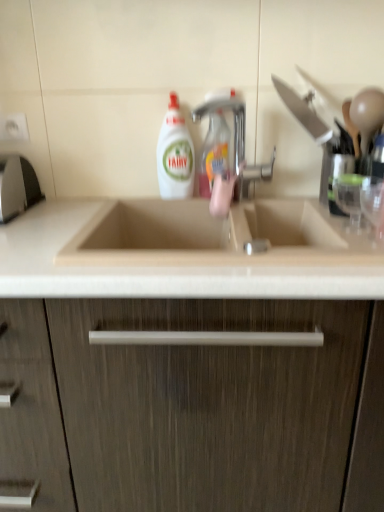
Image resolution: width=384 pixels, height=512 pixels. What do you see at coordinates (14, 127) in the screenshot? I see `white plastic electric outlet at upper left` at bounding box center [14, 127].

In order to face beige wood cabinet at center, should I rotate leftwards or rightwards?

Rotate your view left by about 1.898°.

The height and width of the screenshot is (512, 384). What do you see at coordinates (181, 253) in the screenshot? I see `beige marble countertop at center` at bounding box center [181, 253].

Find the location of `beige marble countertop at center`. beige marble countertop at center is located at coordinates (181, 253).

Describe the element at coordinates (213, 146) in the screenshot. I see `translucent plastic spray bottle at center, which is counted as the second cleaning product, starting from the left` at that location.

Where is `white plastic electric outlet at upper left`? Image resolution: width=384 pixels, height=512 pixels. white plastic electric outlet at upper left is located at coordinates (14, 127).

Is white plastic electric outlet at upper left a part of beige wood cabinet at center?

No.

Can you confirm if beige wood cabinet at center is positioned to the left of white plastic electric outlet at upper left?

In fact, beige wood cabinet at center is to the right of white plastic electric outlet at upper left.

Is beige wood cabinet at center touching white plastic electric outlet at upper left?

No, beige wood cabinet at center is not in contact with white plastic electric outlet at upper left.

Identify the location of electric outlet that appears on the left of white glossy liquid at center, the 1th cleaning product positioned from the left. (14, 127).

In the scene shown: From the image's perspective, between white plastic electric outlet at upper left and white glossy liquid at center, the second cleaning product in the right-to-left sequence, which one is located above?

From the image's view, white plastic electric outlet at upper left is above.

Can white glossy liquid at center, the second cleaning product in the right-to-left sequence, be found inside white plastic electric outlet at upper left?

No, white plastic electric outlet at upper left does not contain white glossy liquid at center, the second cleaning product in the right-to-left sequence.

Is white plastic electric outlet at upper left taller or shorter than white glossy liquid at center, the 1th cleaning product positioned from the left?

In the image, white plastic electric outlet at upper left appears to be shorter than white glossy liquid at center, the 1th cleaning product positioned from the left.

Does translucent plastic spray bottle at center, which is counted as the second cleaning product, starting from the left, come behind white plastic electric outlet at upper left?

No, it is not.

Based on the photo, is translucent plastic spray bottle at center, which is counted as the second cleaning product, starting from the left, oriented towards white plastic electric outlet at upper left?

No, translucent plastic spray bottle at center, which is counted as the second cleaning product, starting from the left, is not turned towards white plastic electric outlet at upper left.

Consider the image. Would you say translucent plastic spray bottle at center, which is counted as the second cleaning product, starting from the left, is to the left or to the right of white plastic electric outlet at upper left in the picture?

From the image, it's evident that translucent plastic spray bottle at center, which is counted as the second cleaning product, starting from the left, is to the right of white plastic electric outlet at upper left.

Considering the positions of point (152, 260) and point (17, 116), is point (152, 260) closer or farther from the camera than point (17, 116)?

Point (152, 260) is positioned closer to the camera compared to point (17, 116).

From their relative heights in the image, would you say beige marble countertop at center is taller or shorter than white plastic electric outlet at upper left?

Clearly, beige marble countertop at center is taller compared to white plastic electric outlet at upper left.

How many degrees apart are the facing directions of beige marble countertop at center and white plastic electric outlet at upper left?

0.567 degrees.

Is white plastic electric outlet at upper left further to the viewer compared to translucent plastic spray bottle at center, which is counted as the second cleaning product, starting from the left?

Yes, it is.

Considering the sizes of objects white plastic electric outlet at upper left and translucent plastic spray bottle at center, which is counted as the second cleaning product, starting from the left, in the image provided, who is wider, white plastic electric outlet at upper left or translucent plastic spray bottle at center, which is counted as the second cleaning product, starting from the left,?

translucent plastic spray bottle at center, which is counted as the second cleaning product, starting from the left.

Considering the sizes of objects white plastic electric outlet at upper left and translucent plastic spray bottle at center, which is counted as the second cleaning product, starting from the left, in the image provided, who is smaller, white plastic electric outlet at upper left or translucent plastic spray bottle at center, which is counted as the second cleaning product, starting from the left,?

white plastic electric outlet at upper left.

Which is in front, white glossy liquid at center, the 1th cleaning product positioned from the left, or silver metallic faucet at center?

Positioned in front is silver metallic faucet at center.

From a real-world perspective, is white glossy liquid at center, the 1th cleaning product positioned from the left, over silver metallic faucet at center?

Yes, from a real-world perspective, white glossy liquid at center, the 1th cleaning product positioned from the left, is above silver metallic faucet at center.

Is white glossy liquid at center, the 1th cleaning product positioned from the left, wider or thinner than silver metallic faucet at center?

white glossy liquid at center, the 1th cleaning product positioned from the left, is thinner than silver metallic faucet at center.

Which object is positioned more to the left, white glossy liquid at center, the 1th cleaning product positioned from the left, or silver metallic faucet at center?

white glossy liquid at center, the 1th cleaning product positioned from the left.

Considering the sizes of objects white glossy liquid at center, the second cleaning product in the right-to-left sequence, and white plastic electric outlet at upper left in the image provided, who is thinner, white glossy liquid at center, the second cleaning product in the right-to-left sequence, or white plastic electric outlet at upper left?

white plastic electric outlet at upper left.

Could you tell me if white glossy liquid at center, the second cleaning product in the right-to-left sequence, is facing white plastic electric outlet at upper left?

No.

Measure the distance between white glossy liquid at center, the 1th cleaning product positioned from the left, and white plastic electric outlet at upper left.

The distance of white glossy liquid at center, the 1th cleaning product positioned from the left, from white plastic electric outlet at upper left is 17.33 inches.

Do you think white glossy liquid at center, the second cleaning product in the right-to-left sequence, is within white plastic electric outlet at upper left, or outside of it?

white glossy liquid at center, the second cleaning product in the right-to-left sequence, is not enclosed by white plastic electric outlet at upper left.

Identify the location of electric outlet behind the beige wood cabinet at center. The width and height of the screenshot is (384, 512). (14, 127).

From the white plastic electric outlet at upper left, count 1st cleaning products forward and point to it. Please provide its 2D coordinates.

[(175, 154)]

When comparing their distances from silver metallic faucet at center, does white plastic electric outlet at upper left or beige marble countertop at center seem closer?

beige marble countertop at center is positioned closer to the anchor silver metallic faucet at center.

Based on their spatial positions, is silver metallic faucet at center or translucent plastic spray bottle at center, which is counted as the second cleaning product, starting from the left, further from beige marble countertop at center?

The object further to beige marble countertop at center is silver metallic faucet at center.

Which object lies further to the anchor point white plastic electric outlet at upper left, beige wood cabinet at center or silver metallic faucet at center?

beige wood cabinet at center.

Estimate the real-world distances between objects in this image. Which object is further from white plastic electric outlet at upper left, beige wood cabinet at center or translucent plastic spray bottle at center, the first cleaning product positioned from the right?

Among the two, beige wood cabinet at center is located further to white plastic electric outlet at upper left.

From the image, which object appears to be farther from white glossy liquid at center, the second cleaning product in the right-to-left sequence, translucent plastic spray bottle at center, the first cleaning product positioned from the right, or white plastic electric outlet at upper left?

white plastic electric outlet at upper left is further to white glossy liquid at center, the second cleaning product in the right-to-left sequence.

Which object lies further to the anchor point white plastic electric outlet at upper left, white glossy liquid at center, the 1th cleaning product positioned from the left, or silver metallic faucet at center?

silver metallic faucet at center is further to white plastic electric outlet at upper left.

Based on their spatial positions, is silver metallic faucet at center or beige wood cabinet at center further from white plastic electric outlet at upper left?

beige wood cabinet at center lies further to white plastic electric outlet at upper left than the other object.

Which object lies further to the anchor point beige marble countertop at center, silver metallic faucet at center or white plastic electric outlet at upper left?

white plastic electric outlet at upper left lies further to beige marble countertop at center than the other object.

Identify the location of countertop between silver metallic faucet at center and beige wood cabinet at center from top to bottom. (181, 253).

Find the location of `cleaning product between beige marble countertop at center and white glossy liquid at center, the second cleaning product in the right-to-left sequence, from front to back`. cleaning product between beige marble countertop at center and white glossy liquid at center, the second cleaning product in the right-to-left sequence, from front to back is located at coordinates (213, 146).

What are the coordinates of `tap between white plastic electric outlet at upper left and beige marble countertop at center` in the screenshot? It's located at (234, 121).

Find the location of a particular element. The image size is (384, 512). cleaning product between silver metallic faucet at center and white glossy liquid at center, the second cleaning product in the right-to-left sequence, along the z-axis is located at coordinates (213, 146).